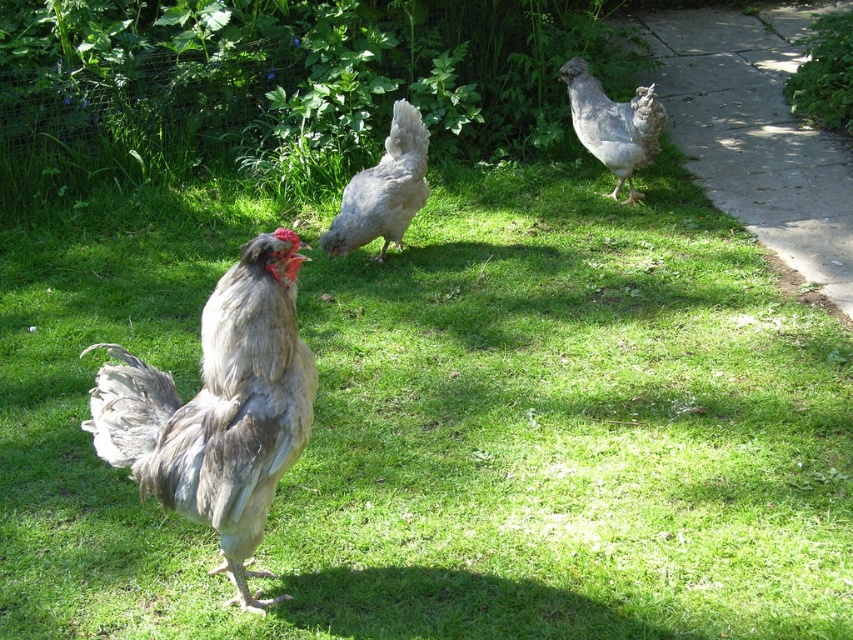
Who is positioned more to the right, concrete at right or gray feathered chicken at right?

concrete at right is more to the right.

Is point (751, 58) closer to camera compared to point (610, 144)?

That is False.

Locate an element on the screen. The width and height of the screenshot is (853, 640). concrete at right is located at coordinates (756, 132).

Can you confirm if gray feathered rooster at center is taller than gray feathered chicken at right?

Indeed, gray feathered rooster at center has a greater height compared to gray feathered chicken at right.

Is gray feathered rooster at center bigger than gray feathered chicken at right?

Correct, gray feathered rooster at center is larger in size than gray feathered chicken at right.

At what (x,y) coordinates should I click in order to perform the action: click on gray feathered rooster at center. Please return your answer as a coordinate pair (x, y). This screenshot has width=853, height=640. Looking at the image, I should click on (219, 408).

Can you confirm if gray feathered rooster at center is wider than concrete at right?

In fact, gray feathered rooster at center might be narrower than concrete at right.

Between gray feathered rooster at center and concrete at right, which one appears on the left side from the viewer's perspective?

gray feathered rooster at center

What do you see at coordinates (219, 408) in the screenshot? I see `gray feathered rooster at center` at bounding box center [219, 408].

Locate an element on the screen. This screenshot has height=640, width=853. gray feathered rooster at center is located at coordinates (219, 408).